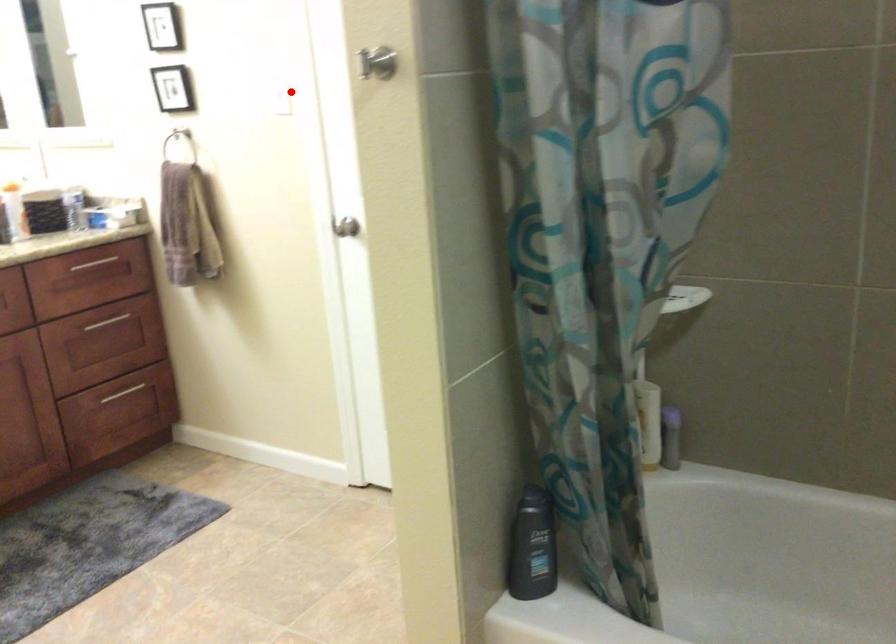
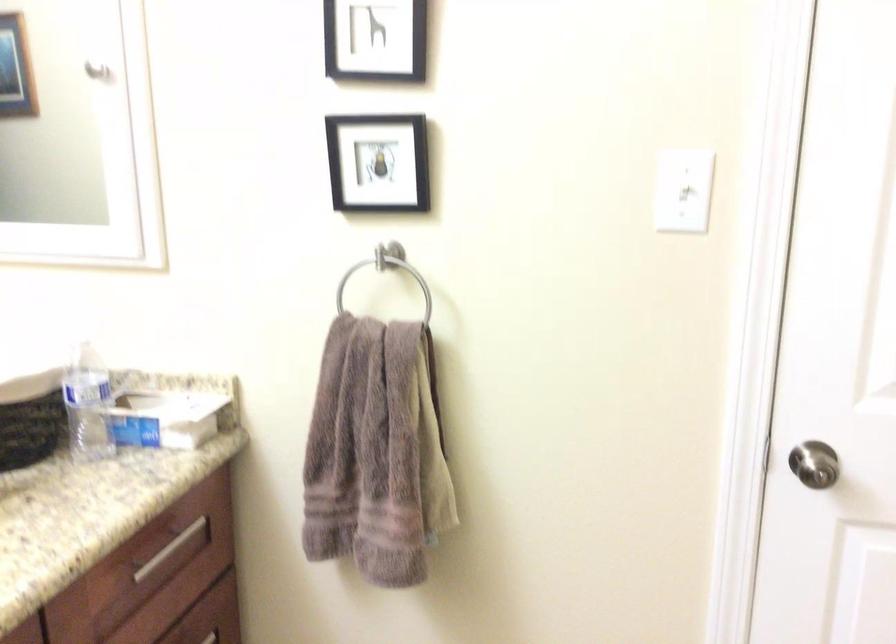
Question: I am providing you with two images of the same scene from different viewpoints. A red point is marked on the first image. Is the red point's position out of view in image 2?

Choices:
 (A) Yes
 (B) No

Answer: (B)